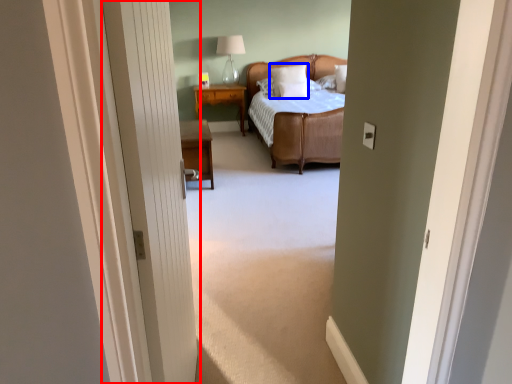
Question: Which of the following is the closest to the observer, door (highlighted by a red box) or pillow (highlighted by a blue box)?

Choices:
 (A) door
 (B) pillow

Answer: (A)